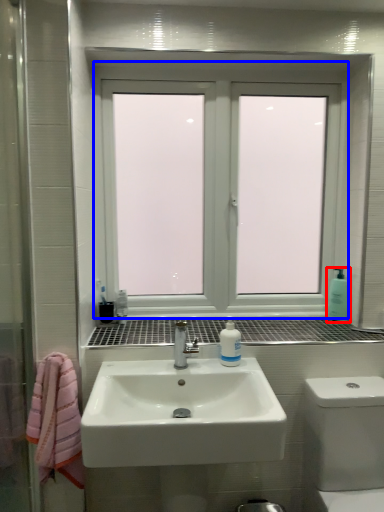
Question: Among these objects, which one is nearest to the camera, soap dispenser (highlighted by a red box) or window (highlighted by a blue box)?

Choices:
 (A) soap dispenser
 (B) window

Answer: (B)